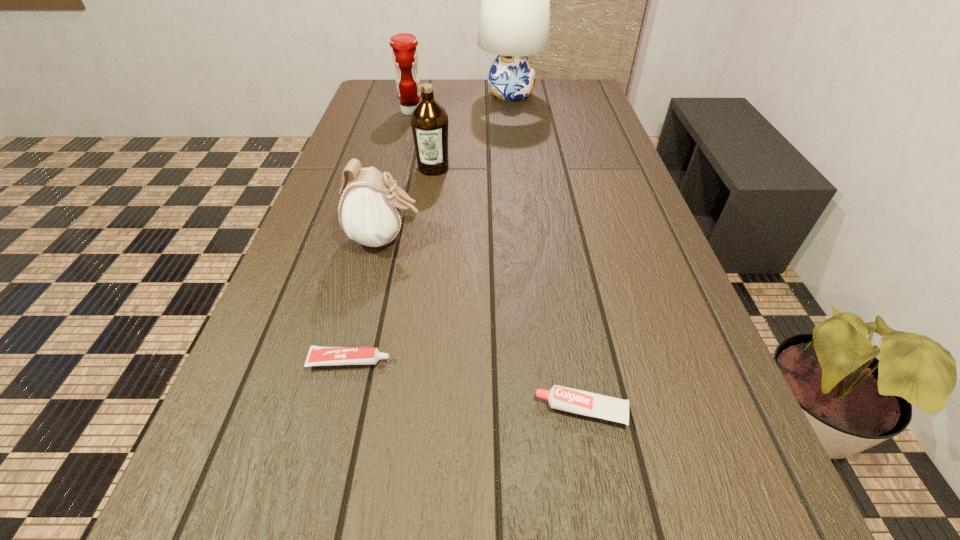
Where is `vacant region that satisfies the following two spatial constraints: 1. on the back side of the nearest object; 2. at the nozzle of the second nearest object`? Image resolution: width=960 pixels, height=540 pixels. vacant region that satisfies the following two spatial constraints: 1. on the back side of the nearest object; 2. at the nozzle of the second nearest object is located at coordinates point(573,361).

The width and height of the screenshot is (960, 540). I want to click on free point that satisfies the following two spatial constraints: 1. on the label of the third farthest object; 2. on the right side of the nearer toothpaste, so click(399, 410).

Image resolution: width=960 pixels, height=540 pixels. Identify the location of free space that satisfies the following two spatial constraints: 1. at the nozzle of the farther toothpaste; 2. on the right side of the nearest object. [x=338, y=410].

This screenshot has width=960, height=540. What are the coordinates of `vacant area that satisfies the following two spatial constraints: 1. on the label of the third farthest object; 2. at the nozzle of the second nearest object` in the screenshot? It's located at (406, 361).

At what (x,y) coordinates should I click in order to perform the action: click on free space that satisfies the following two spatial constraints: 1. on the label of the nearer toothpaste; 2. on the right side of the olive oil. Please return your answer as a coordinate pair (x, y). This screenshot has height=540, width=960. Looking at the image, I should click on (399, 410).

Find the location of `free location that satisfies the following two spatial constraints: 1. on the label of the right toothpaste; 2. on the right side of the olive oil`. free location that satisfies the following two spatial constraints: 1. on the label of the right toothpaste; 2. on the right side of the olive oil is located at coordinates (399, 410).